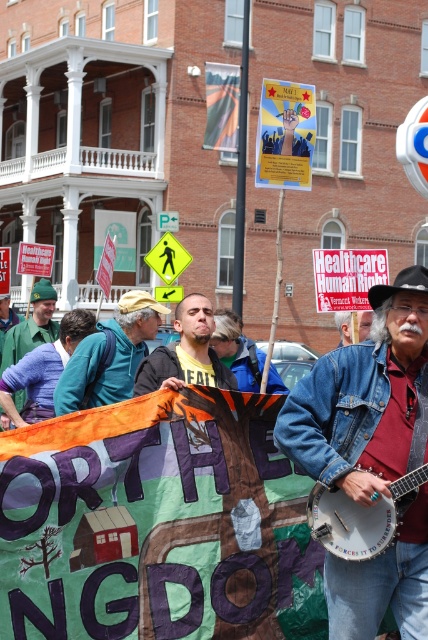
Looking at this image, can you confirm if purple cotton shirt at left is positioned to the right of denim jacket at lower right?

Incorrect, purple cotton shirt at left is not on the right side of denim jacket at lower right.

Does point (56, 330) come farther from viewer compared to point (362, 339)?

Yes, it is.

In order to click on purple cotton shirt at left in this screenshot , I will do coord(32,324).

Image resolution: width=428 pixels, height=640 pixels. Describe the element at coordinates (186, 353) in the screenshot. I see `yellow t-shirt at center` at that location.

Identify the location of yellow t-shirt at center. The height and width of the screenshot is (640, 428). (186, 353).

The width and height of the screenshot is (428, 640). In order to click on yellow t-shirt at center in this screenshot , I will do click(x=186, y=353).

Does teal fleece jacket at center have a greater height compared to wooden banjo at center?

Indeed, teal fleece jacket at center has a greater height compared to wooden banjo at center.

Which is more to the left, teal fleece jacket at center or wooden banjo at center?

From the viewer's perspective, teal fleece jacket at center appears more on the left side.

Find the location of a particular element. This screenshot has width=428, height=640. teal fleece jacket at center is located at coordinates (112, 355).

Find the location of a particular element. teal fleece jacket at center is located at coordinates (112, 355).